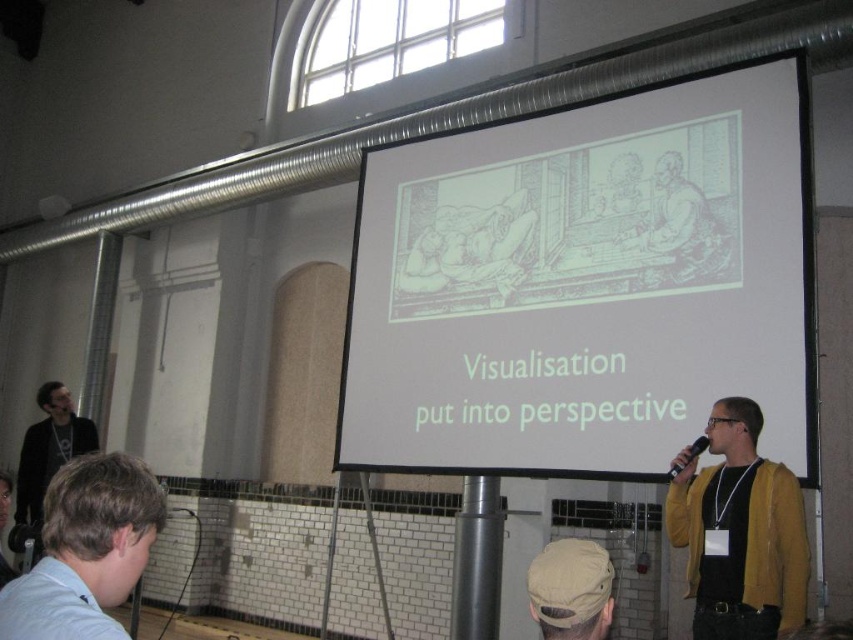
In the scene shown: Is the position of yellow cardigan at right more distant than that of light blue shirt at lower left?

Yes, it is.

Can you confirm if yellow cardigan at right is bigger than light blue shirt at lower left?

Yes, yellow cardigan at right is bigger than light blue shirt at lower left.

Describe the element at coordinates (740, 531) in the screenshot. I see `yellow cardigan at right` at that location.

At what (x,y) coordinates should I click in order to perform the action: click on yellow cardigan at right. Please return your answer as a coordinate pair (x, y). The image size is (853, 640). Looking at the image, I should click on (740, 531).

Can you confirm if yellow cardigan at right is shorter than khaki fabric cap at center?

Incorrect, yellow cardigan at right's height does not fall short of khaki fabric cap at center's.

Which is behind, point (735, 467) or point (534, 620)?

Positioned behind is point (735, 467).

At what (x,y) coordinates should I click in order to perform the action: click on yellow cardigan at right. Please return your answer as a coordinate pair (x, y). The height and width of the screenshot is (640, 853). Looking at the image, I should click on (740, 531).

Can you confirm if white paper at center is wider than yellow cardigan at right?

Yes, white paper at center is wider than yellow cardigan at right.

Between white paper at center and yellow cardigan at right, which one has less height?

yellow cardigan at right

The width and height of the screenshot is (853, 640). What do you see at coordinates (585, 284) in the screenshot?
I see `white paper at center` at bounding box center [585, 284].

At what (x,y) coordinates should I click in order to perform the action: click on white paper at center. Please return your answer as a coordinate pair (x, y). The image size is (853, 640). Looking at the image, I should click on (585, 284).